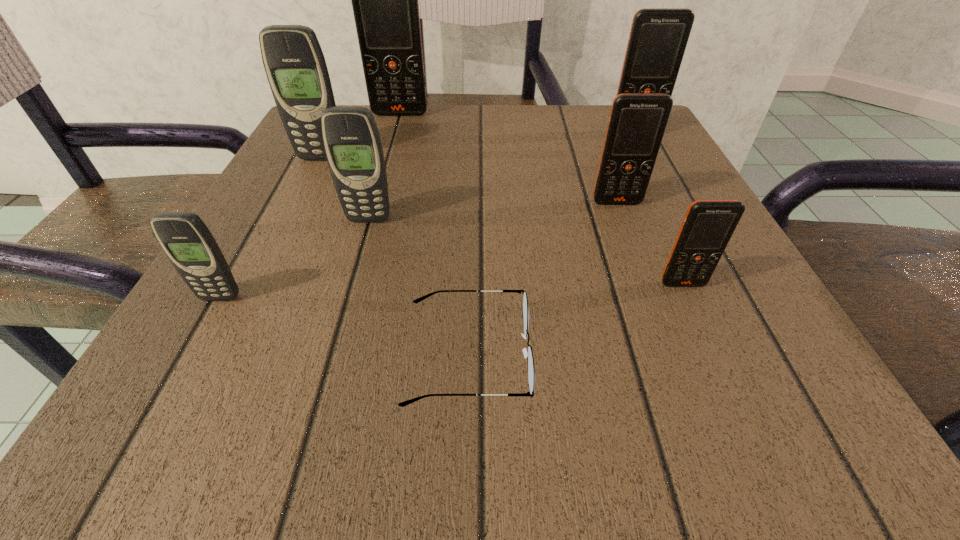
This screenshot has width=960, height=540. Find the location of `vacant space located 0.360m on the screen of the fourth nearest cellular telephone`. vacant space located 0.360m on the screen of the fourth nearest cellular telephone is located at coordinates (694, 409).

Image resolution: width=960 pixels, height=540 pixels. In order to click on vacant region located on the screen of the third nearest object in this screenshot , I will do `click(709, 343)`.

What are the coordinates of `vacant space located on the screen of the second nearest object` in the screenshot? It's located at (149, 426).

The width and height of the screenshot is (960, 540). I want to click on vacant region located 0.230m on the lenses of the nearest object, so click(x=727, y=355).

The height and width of the screenshot is (540, 960). I want to click on object at the near edge, so pyautogui.click(x=530, y=360).

Find the location of a particular element. object located in the far right corner section of the desktop is located at coordinates (658, 37).

In the image, there is a desktop. What are the coordinates of `free space at the far edge` in the screenshot? It's located at (577, 133).

At what (x,y) coordinates should I click in order to perform the action: click on free space at the near edge of the desktop. Please return your answer as a coordinate pair (x, y). This screenshot has width=960, height=540. Looking at the image, I should click on (467, 433).

Identify the location of blank space at the left edge of the desktop. The height and width of the screenshot is (540, 960). (231, 309).

In the image, there is a desktop. Where is `vacant space at the far right corner`? vacant space at the far right corner is located at coordinates [579, 113].